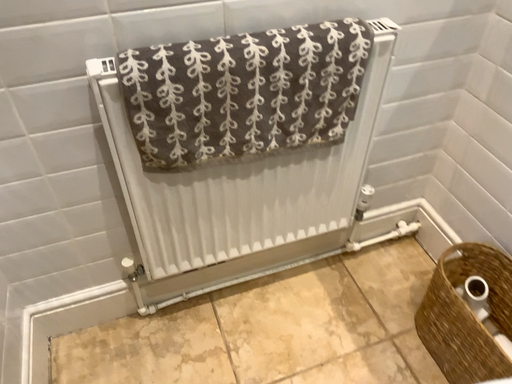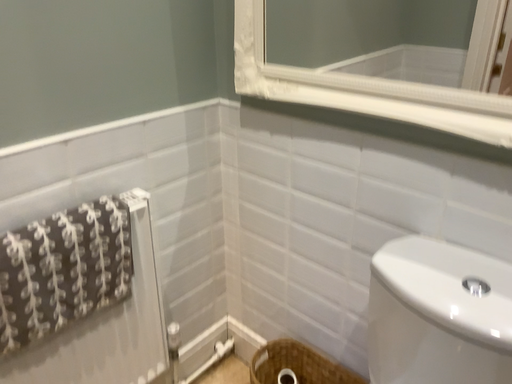
Question: Which way did the camera rotate in the video?

Choices:
 (A) rotated right
 (B) rotated left

Answer: (A)